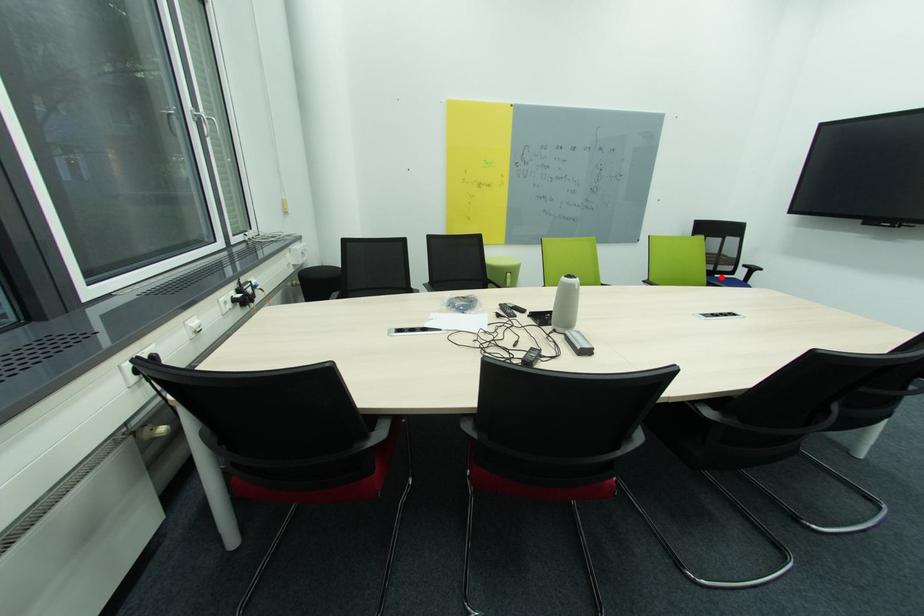
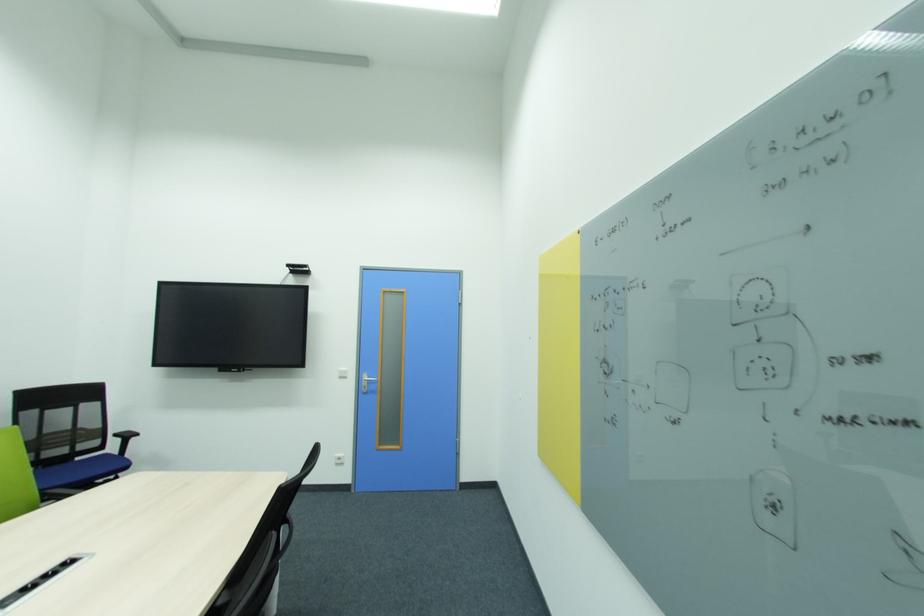
Where in the second image is the point corresponding to the highlighted location from the first image?

(82, 460)